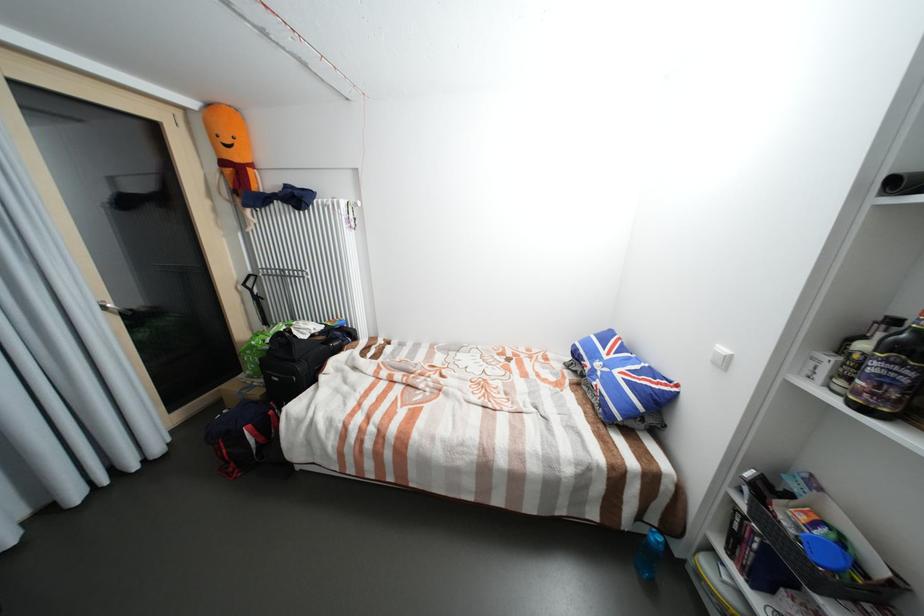
Where is `silver door handle`? silver door handle is located at coordinates (111, 308).